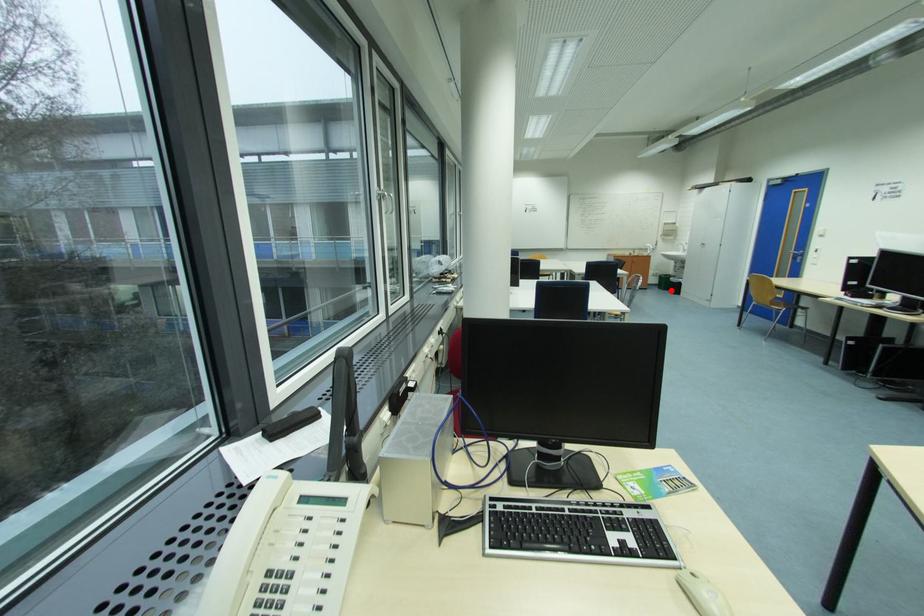
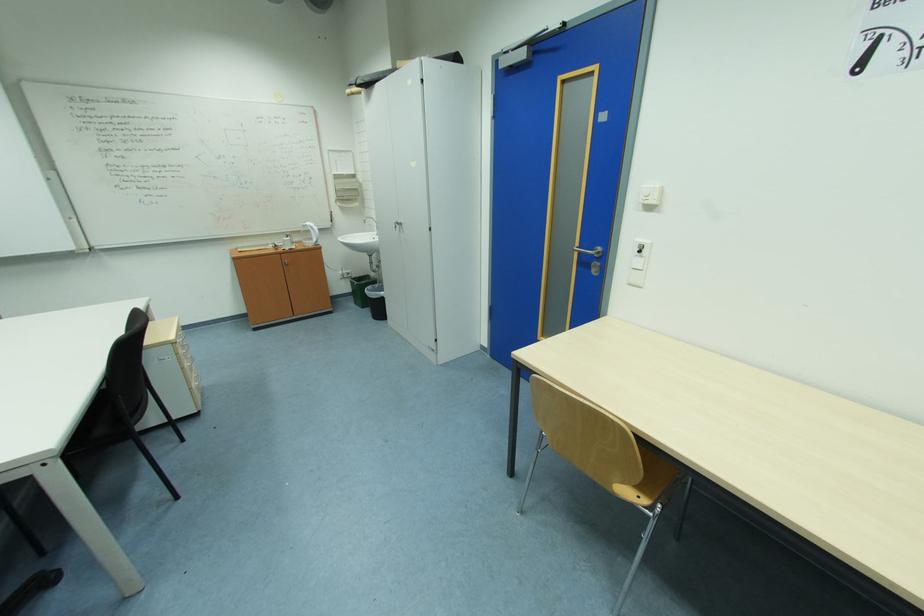
Question: I am providing you with two images of the same scene from different viewpoints. In image1, a red point is highlighted. Considering the same 3D point in image2, which of the following is correct?

Choices:
 (A) It is closer
 (B) It is farther

Answer: (B)